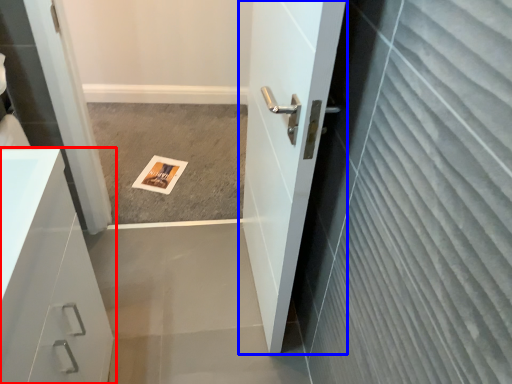
Question: Among these objects, which one is nearest to the camera, bathroom cabinet (highlighted by a red box) or door (highlighted by a blue box)?

Choices:
 (A) bathroom cabinet
 (B) door

Answer: (A)